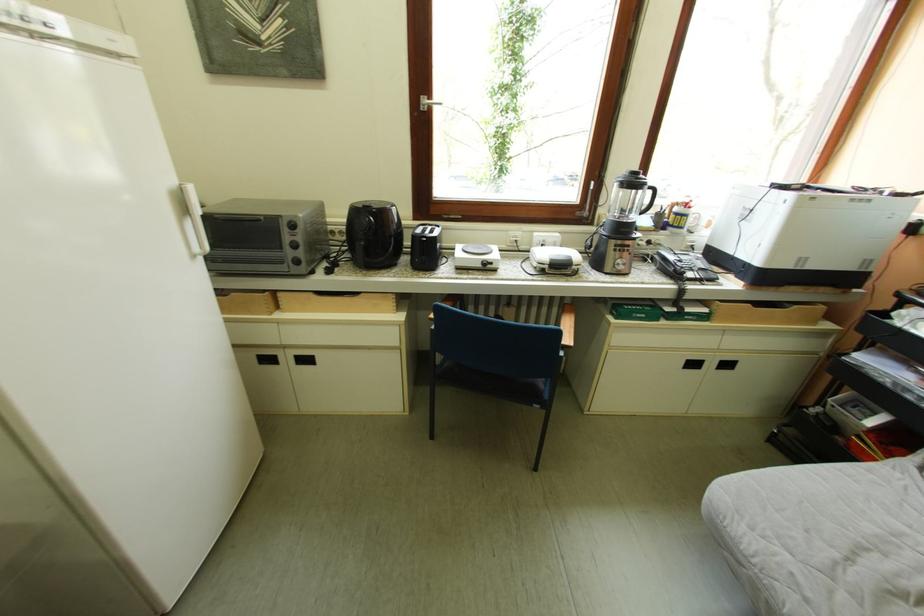
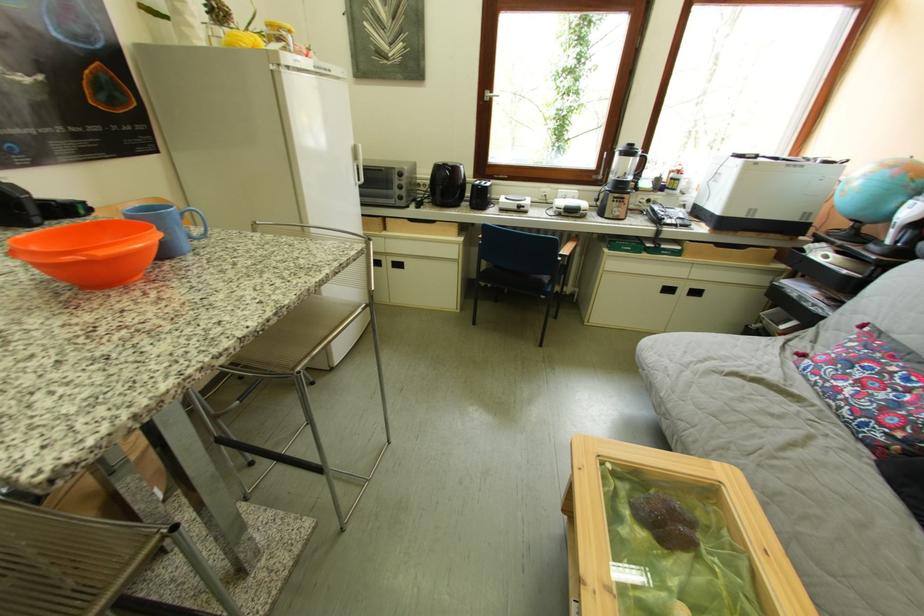
Locate, in the second image, the point that corresponds to point (323, 296) in the first image.

(419, 223)